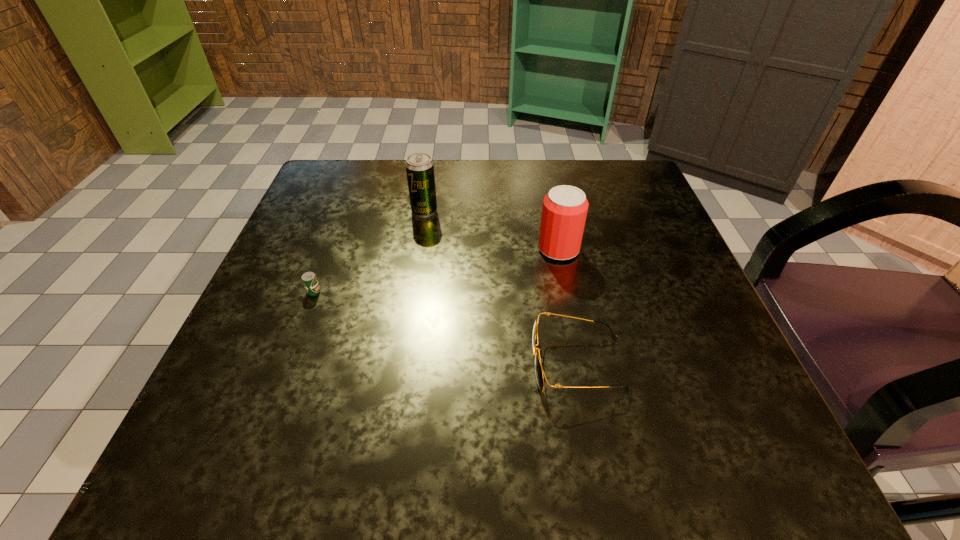
Identify the location of the second object from left to right. (419, 166).

You are a GUI agent. You are given a task and a screenshot of the screen. Output one action in this format:
    pyautogui.click(x=<x>, y=<y>)
    Task: Click on the farthest object
    This screenshot has height=540, width=960.
    Given the screenshot: What is the action you would take?
    pyautogui.click(x=419, y=166)

Locate an element on the screen. the third nearest object is located at coordinates (564, 211).

Identify the location of the second farthest beer can. This screenshot has width=960, height=540. (564, 211).

The image size is (960, 540). In order to click on the second shortest object in this screenshot , I will do `click(539, 373)`.

At what (x,y) coordinates should I click in order to perform the action: click on sunglasses. Please return your answer as a coordinate pair (x, y). The width and height of the screenshot is (960, 540). Looking at the image, I should click on (539, 373).

Identify the location of the second nearest object. (309, 279).

Locate an element on the screen. The width and height of the screenshot is (960, 540). the leftmost object is located at coordinates (309, 279).

This screenshot has width=960, height=540. Find the location of `blank space located 0.120m on the front of the second beer can from left to right`. blank space located 0.120m on the front of the second beer can from left to right is located at coordinates (417, 258).

Where is `free point located on the left of the second farthest beer can`? Image resolution: width=960 pixels, height=540 pixels. free point located on the left of the second farthest beer can is located at coordinates (410, 249).